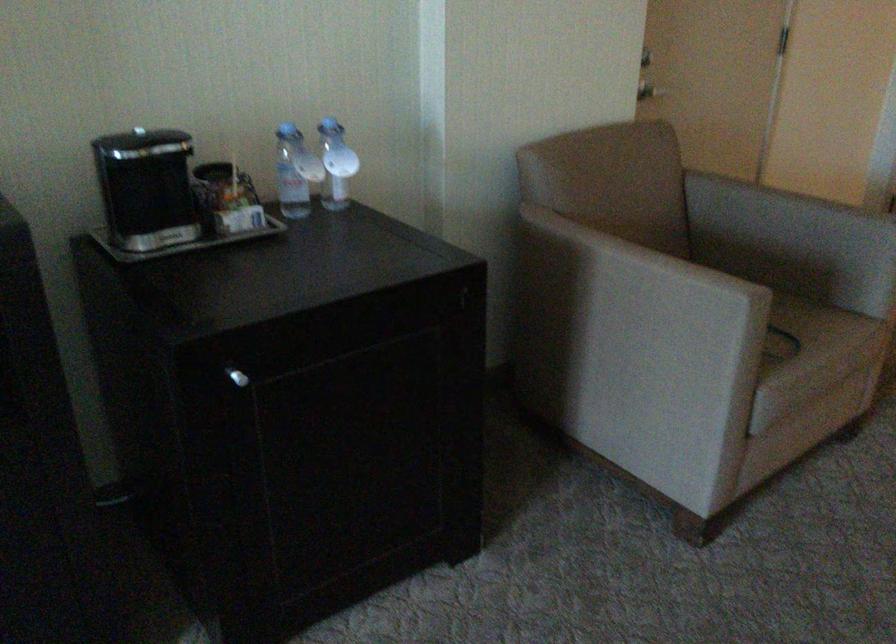
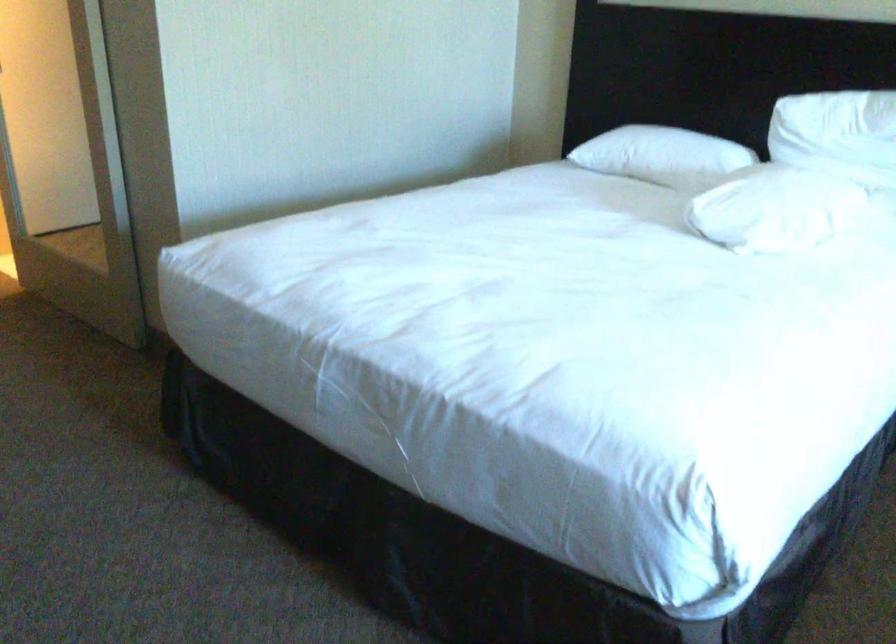
The first image is from the beginning of the video and the second image is from the end. How did the camera likely rotate when shooting the video?

The rotation direction of the camera is right-down.